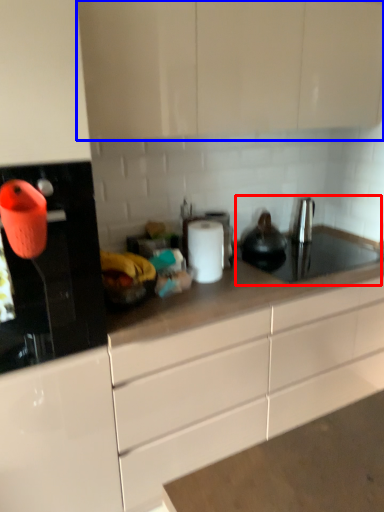
Question: Which point is closer to the camera, sink (highlighted by a red box) or cabinetry (highlighted by a blue box)?

Choices:
 (A) sink
 (B) cabinetry

Answer: (B)